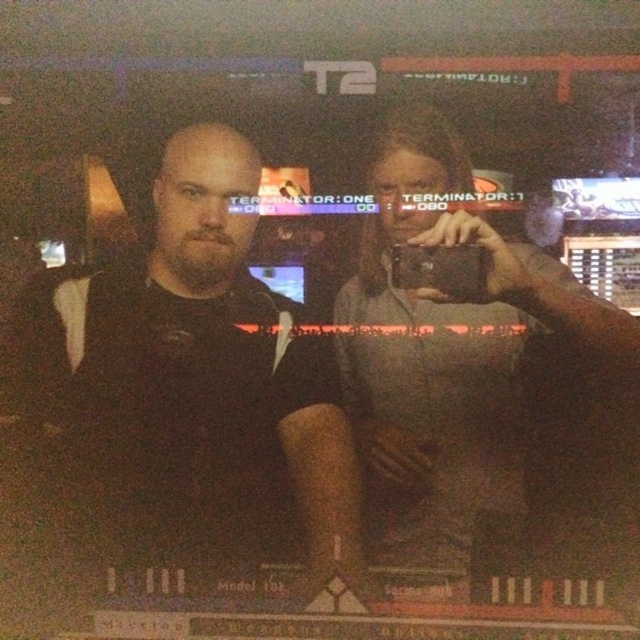
Question: Which point appears farthest from the camera in this image?

Choices:
 (A) (483, 266)
 (B) (378, 481)

Answer: (B)

Question: Is black matte shirt at center below black matte camera at center?

Choices:
 (A) no
 (B) yes

Answer: (B)

Question: From the image, what is the correct spatial relationship of gray fabric shirt at upper center in relation to black matte camera at center?

Choices:
 (A) below
 (B) above

Answer: (A)

Question: Based on their relative distances, which object is farther from the gray fabric shirt at upper center?

Choices:
 (A) black matte camera at center
 (B) black matte shirt at center

Answer: (B)

Question: From the image, what is the correct spatial relationship of black matte shirt at center in relation to black matte camera at center?

Choices:
 (A) right
 (B) left

Answer: (B)

Question: Which object is closer to the camera taking this photo?

Choices:
 (A) black matte camera at center
 (B) black matte shirt at center
 (C) gray fabric shirt at upper center

Answer: (C)